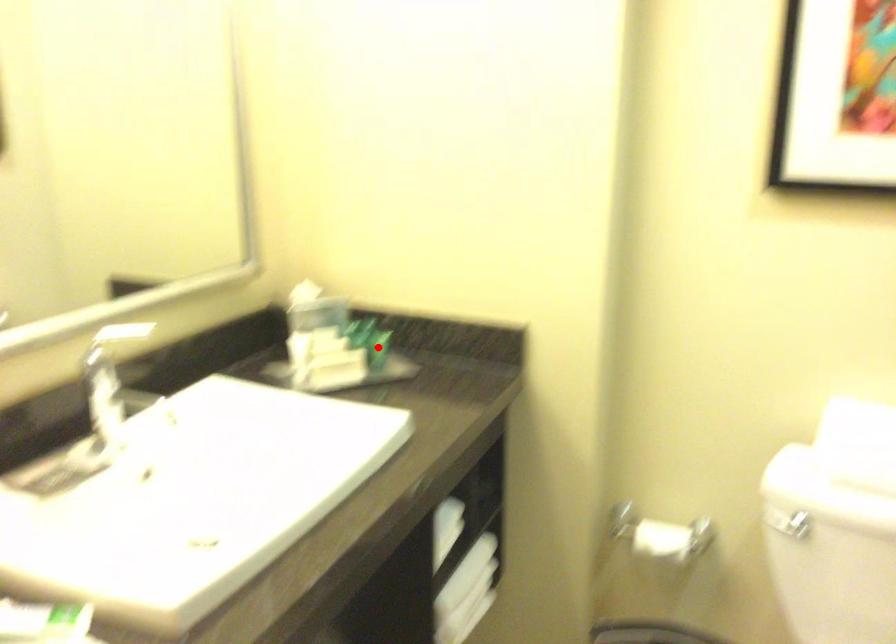
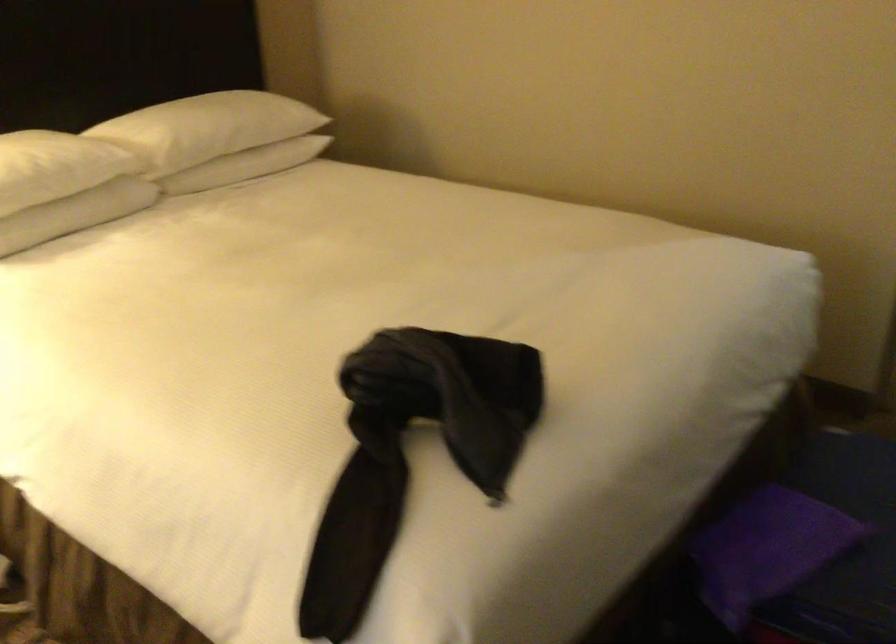
Question: I am providing you with two images of the same scene from different viewpoints. A red point is marked on the first image. Is the red point's position out of view in image 2?

Choices:
 (A) Yes
 (B) No

Answer: (A)